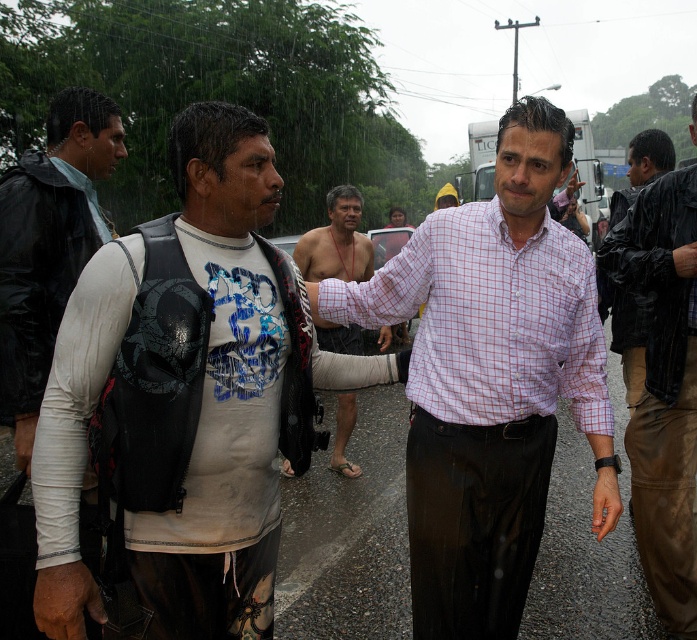
You are standing at the point with coordinates point (x=323, y=273) and want to walk towards the point with coordinates point (x=36, y=378). Which direction should you face to walk directly towards your destination?

You should face forward because point (x=36, y=378) is in front of point (x=323, y=273).